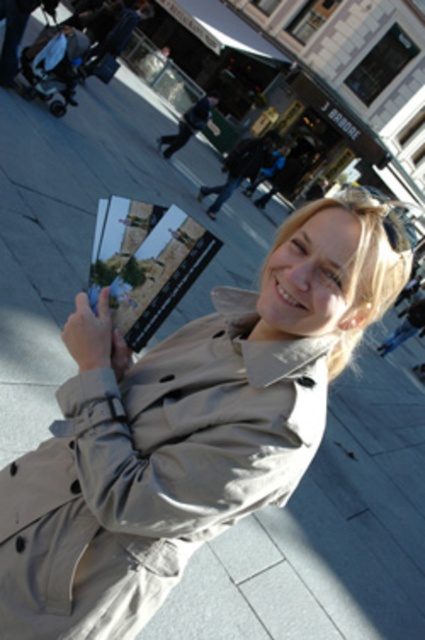
Question: Is light beige trench coat at center closer to camera compared to matte gray phone at lower left?

Choices:
 (A) yes
 (B) no

Answer: (A)

Question: Which of the following is the farthest from the observer?

Choices:
 (A) light beige trench coat at center
 (B) matte gray phone at lower left

Answer: (B)

Question: Can you confirm if light beige trench coat at center is thinner than matte gray phone at lower left?

Choices:
 (A) no
 (B) yes

Answer: (A)

Question: Which point is closer to the camera taking this photo?

Choices:
 (A) (105, 348)
 (B) (133, 394)

Answer: (B)

Question: Is light beige trench coat at center to the right of matte gray phone at lower left from the viewer's perspective?

Choices:
 (A) yes
 (B) no

Answer: (A)